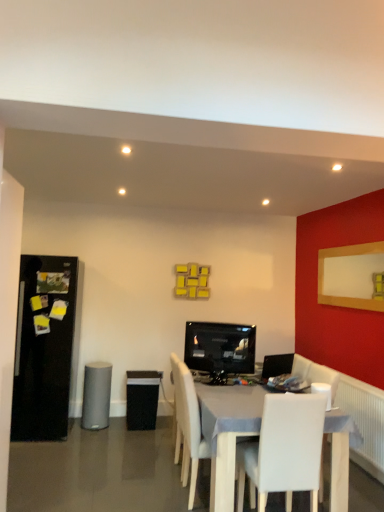
At what (x,y) coordinates should I click in order to perform the action: click on white wood chair at center, placed as the first chair when sorted from back to front. Please return your answer as a coordinate pair (x, y). Looking at the image, I should click on (190, 430).

Describe the element at coordinates (227, 433) in the screenshot. I see `white wooden table at center` at that location.

Find the location of a particular element. white leather chair at center, the 2th chair when ordered from back to front is located at coordinates (284, 450).

Describe the element at coordinates (284, 450) in the screenshot. The height and width of the screenshot is (512, 384). I see `white leather chair at center, acting as the first chair starting from the front` at that location.

Locate an element on the screen. black glossy tv at center is located at coordinates (220, 348).

What do you see at coordinates (142, 399) in the screenshot? The width and height of the screenshot is (384, 512). I see `black mesh speaker at center, acting as the third speaker starting from the front` at bounding box center [142, 399].

Locate an element on the screen. black glossy refrigerator at left is located at coordinates (44, 348).

Is white wooden table at center facing towards white plastic speaker at lower right, the first speaker in the right-to-left sequence?

No.

Could you measure the distance between white wooden table at center and white plastic speaker at lower right, placed as the 1th speaker when sorted from front to back?

white wooden table at center and white plastic speaker at lower right, placed as the 1th speaker when sorted from front to back, are 24.53 inches apart.

Is white wooden table at center smaller than white plastic speaker at lower right, placed as the 1th speaker when sorted from front to back?

No, white wooden table at center is not smaller than white plastic speaker at lower right, placed as the 1th speaker when sorted from front to back.

Which is closer to the camera, (251, 388) or (316, 382)?

Clearly, point (251, 388) is closer to the camera than point (316, 382).

This screenshot has height=512, width=384. Identify the location of fridge above the white plastic speaker at lower right, the third speaker when ordered from left to right (from the image's perspective). (44, 348).

Can you tell me how much white plastic speaker at lower right, the third speaker when ordered from left to right, and black glossy refrigerator at left differ in facing direction?

There is a 180-degree angle between the facing directions of white plastic speaker at lower right, the third speaker when ordered from left to right, and black glossy refrigerator at left.

Is white plastic speaker at lower right, placed as the 1th speaker when sorted from front to back, positioned with its back to black glossy refrigerator at left?

No, white plastic speaker at lower right, placed as the 1th speaker when sorted from front to back, is not facing the opposite direction of black glossy refrigerator at left.

Does white plastic speaker at lower right, the third speaker when ordered from left to right, lie behind black glossy refrigerator at left?

No, white plastic speaker at lower right, the third speaker when ordered from left to right, is closer to the camera.

From the image's perspective, which is above, white wood chair at center, which is the 2th chair in front-to-back order, or white leather chair at center, acting as the first chair starting from the front?

white leather chair at center, acting as the first chair starting from the front, from the image's perspective.

Between white wood chair at center, placed as the first chair when sorted from back to front, and white leather chair at center, acting as the first chair starting from the front, which one appears on the right side from the viewer's perspective?

From the viewer's perspective, white leather chair at center, acting as the first chair starting from the front, appears more on the right side.

Is point (190, 416) more distant than point (319, 421)?

Yes, point (190, 416) is farther from viewer.

Can you tell me how much white wood chair at center, placed as the first chair when sorted from back to front, and white leather chair at center, acting as the first chair starting from the front, differ in facing direction?

The facing directions of white wood chair at center, placed as the first chair when sorted from back to front, and white leather chair at center, acting as the first chair starting from the front, are 90.9 degrees apart.

Does gray matte speaker at lower left, placed as the 2th speaker when sorted from back to front, turn towards white plastic speaker at lower right, placed as the 1th speaker when sorted from front to back?

No, gray matte speaker at lower left, placed as the 2th speaker when sorted from back to front, is not facing towards white plastic speaker at lower right, placed as the 1th speaker when sorted from front to back.

Looking at this image, considering the sizes of objects gray matte speaker at lower left, the first speaker from the left, and white plastic speaker at lower right, the third speaker when ordered from left to right, in the image provided, who is wider, gray matte speaker at lower left, the first speaker from the left, or white plastic speaker at lower right, the third speaker when ordered from left to right,?

Wider between the two is gray matte speaker at lower left, the first speaker from the left.

Considering the relative positions of gray matte speaker at lower left, the second speaker viewed from the front, and white plastic speaker at lower right, placed as the 1th speaker when sorted from front to back, in the image provided, is gray matte speaker at lower left, the second speaker viewed from the front, to the left of white plastic speaker at lower right, placed as the 1th speaker when sorted from front to back, from the viewer's perspective?

Indeed, gray matte speaker at lower left, the second speaker viewed from the front, is positioned on the left side of white plastic speaker at lower right, placed as the 1th speaker when sorted from front to back.

From a real-world perspective, is gray matte speaker at lower left, the second speaker viewed from the front, under white plastic speaker at lower right, placed as the 1th speaker when sorted from front to back?

Yes.

Is gray matte speaker at lower left, the second speaker viewed from the front, surrounded by white plastic speaker at lower right, the third speaker when ordered from left to right?

Definitely not — gray matte speaker at lower left, the second speaker viewed from the front, is not inside white plastic speaker at lower right, the third speaker when ordered from left to right.

From a real-world perspective, is white plastic speaker at lower right, placed as the 3th speaker when sorted from back to front, above or below gray matte speaker at lower left, placed as the 2th speaker when sorted from back to front?

Clearly, from a real-world perspective, white plastic speaker at lower right, placed as the 3th speaker when sorted from back to front, is above gray matte speaker at lower left, placed as the 2th speaker when sorted from back to front.

Can you confirm if white plastic speaker at lower right, the first speaker in the right-to-left sequence, is taller than gray matte speaker at lower left, the second speaker viewed from the front?

In fact, white plastic speaker at lower right, the first speaker in the right-to-left sequence, may be shorter than gray matte speaker at lower left, the second speaker viewed from the front.

Is white plastic speaker at lower right, placed as the 3th speaker when sorted from back to front, positioned with its back to gray matte speaker at lower left, the first speaker from the left?

That's not correct — white plastic speaker at lower right, placed as the 3th speaker when sorted from back to front, is not looking away from gray matte speaker at lower left, the first speaker from the left.

Can you confirm if black glossy refrigerator at left is taller than white wooden table at center?

Yes, black glossy refrigerator at left is taller than white wooden table at center.

Considering the sizes of objects black glossy refrigerator at left and white wooden table at center in the image provided, who is wider, black glossy refrigerator at left or white wooden table at center?

Wider between the two is white wooden table at center.

Is black glossy refrigerator at left turned away from white wooden table at center?

Answer: black glossy refrigerator at left is not turned away from white wooden table at center.

Where is `table below the black glossy refrigerator at left (from a real-world perspective)`? table below the black glossy refrigerator at left (from a real-world perspective) is located at coordinates (227, 433).

From a real-world perspective, is black glossy refrigerator at left under black glossy tv at center?

Yes.

From the image's perspective, is black glossy refrigerator at left over black glossy tv at center?

Actually, black glossy refrigerator at left appears below black glossy tv at center in the image.

Is black glossy refrigerator at left directly adjacent to black glossy tv at center?

No, black glossy refrigerator at left is not in contact with black glossy tv at center.

Is black glossy refrigerator at left at the right side of black glossy tv at center?

No.

Image resolution: width=384 pixels, height=512 pixels. Identify the location of speaker above the white wooden table at center (from a real-world perspective). (323, 392).

In order to click on speaker that is the 1st one below the black glossy refrigerator at left (from a real-world perspective) in this screenshot , I will do `click(323, 392)`.

Which object lies further to the anchor point black glossy refrigerator at left, gray matte speaker at lower left, placed as the 3th speaker when sorted from right to left, or white wood chair at center, which is the 2th chair in front-to-back order?

white wood chair at center, which is the 2th chair in front-to-back order.

Which object lies further to the anchor point white plastic speaker at lower right, placed as the 1th speaker when sorted from front to back, black glossy tv at center or black glossy refrigerator at left?

black glossy refrigerator at left is further to white plastic speaker at lower right, placed as the 1th speaker when sorted from front to back.

Looking at the image, which one is located further to white wood chair at center, placed as the first chair when sorted from back to front, gray matte speaker at lower left, the second speaker viewed from the front, or black glossy tv at center?

gray matte speaker at lower left, the second speaker viewed from the front.

Considering their positions, is gray matte speaker at lower left, placed as the 2th speaker when sorted from back to front, positioned closer to black glossy tv at center than white plastic speaker at lower right, placed as the 1th speaker when sorted from front to back?

Among the two, white plastic speaker at lower right, placed as the 1th speaker when sorted from front to back, is located nearer to black glossy tv at center.

Estimate the real-world distances between objects in this image. Which object is further from white wood chair at center, placed as the first chair when sorted from back to front, white wooden table at center or black mesh speaker at center, the 2th speaker positioned from the left?

Based on the image, black mesh speaker at center, the 2th speaker positioned from the left, appears to be further to white wood chair at center, placed as the first chair when sorted from back to front.

Estimate the real-world distances between objects in this image. Which object is closer to black glossy tv at center, black glossy refrigerator at left or white wood chair at center, placed as the first chair when sorted from back to front?

The object closer to black glossy tv at center is white wood chair at center, placed as the first chair when sorted from back to front.

Looking at the image, which one is located closer to white leather chair at center, the 2th chair when ordered from back to front, black glossy refrigerator at left or black glossy tv at center?

black glossy tv at center.

Considering their positions, is white wooden table at center positioned closer to white plastic speaker at lower right, the first speaker in the right-to-left sequence, than black glossy tv at center?

white wooden table at center.

At what (x,y) coordinates should I click in order to perform the action: click on television positioned between white wooden table at center and black mesh speaker at center, the 2th speaker positioned from the left, from near to far. Please return your answer as a coordinate pair (x, y). Looking at the image, I should click on (220, 348).

At what (x,y) coordinates should I click in order to perform the action: click on television located between black glossy refrigerator at left and white leather chair at center, acting as the first chair starting from the front, in the left-right direction. Please return your answer as a coordinate pair (x, y). This screenshot has height=512, width=384. Looking at the image, I should click on (220, 348).

Identify the location of chair between white wooden table at center and black mesh speaker at center, the 2th speaker positioned from the left, in the front-back direction. The height and width of the screenshot is (512, 384). (190, 430).

Find the location of a particular element. The height and width of the screenshot is (512, 384). television between gray matte speaker at lower left, placed as the 2th speaker when sorted from back to front, and white plastic speaker at lower right, the third speaker when ordered from left to right is located at coordinates (220, 348).